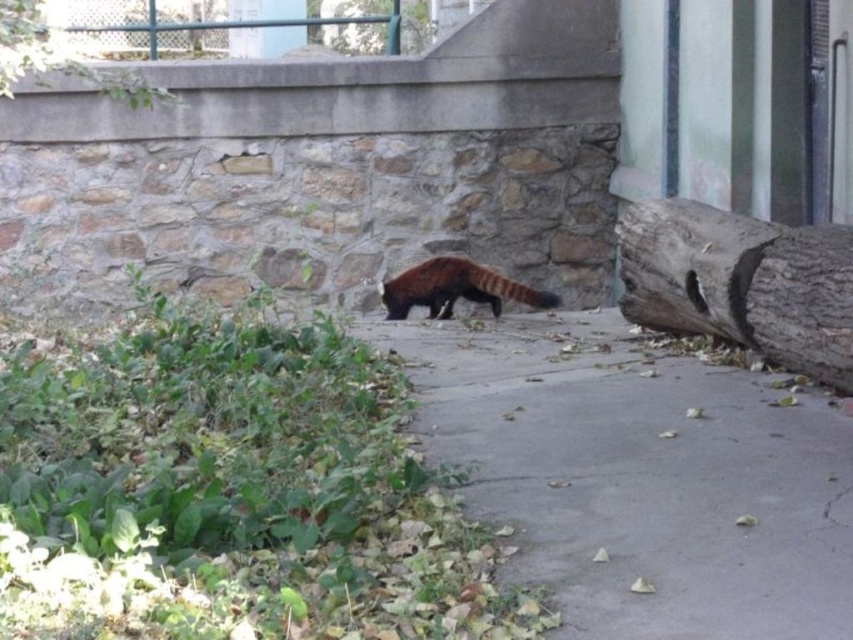
You are a hiker who wants to cross the pathway where the red panda is walking. The gray rough bark tree trunk at right and the brown rough bark tree at upper center are in your way. Which tree should you avoid stepping on to stay on the pathway?

The gray rough bark tree trunk at right is taller than the brown rough bark tree at upper center, so you should avoid stepping on the gray rough bark tree trunk at right to stay on the pathway.